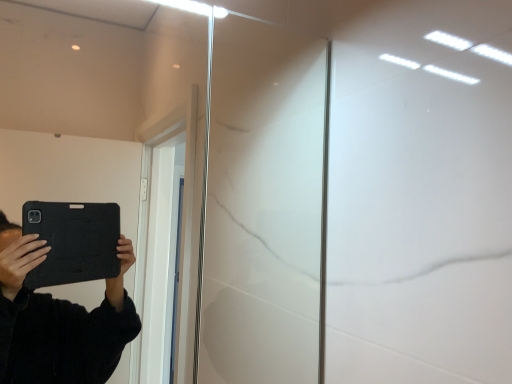
The width and height of the screenshot is (512, 384). Identify the location of white marble mirror at center. (92, 90).

What do you see at coordinates (92, 90) in the screenshot? This screenshot has height=384, width=512. I see `white marble mirror at center` at bounding box center [92, 90].

Where is `white marble mirror at center`? This screenshot has height=384, width=512. white marble mirror at center is located at coordinates (92, 90).